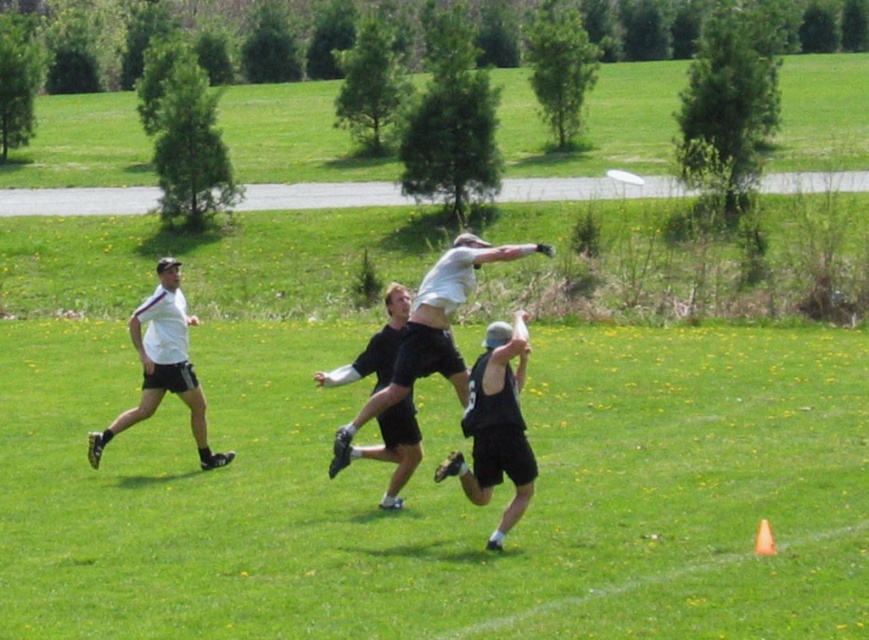
Does black matte tank top at center have a larger size compared to white matte frisbee at upper center?

Yes.

Who is more distant from viewer, [519,412] or [629,172]?

The point [629,172] is more distant.

The image size is (869, 640). I want to click on black matte tank top at center, so click(x=496, y=426).

Between white matte shirt at center and black matte shorts at center, which one has less height?

Standing shorter between the two is black matte shorts at center.

Who is more distant from viewer, (395, 376) or (395, 444)?

The point (395, 444) is behind.

Find the location of a particular element. The height and width of the screenshot is (640, 869). white matte shirt at center is located at coordinates (432, 332).

Is white matte shirt at center positioned before white matte shirt at left?

Yes, it is.

The height and width of the screenshot is (640, 869). Find the location of `white matte shirt at center`. white matte shirt at center is located at coordinates (432, 332).